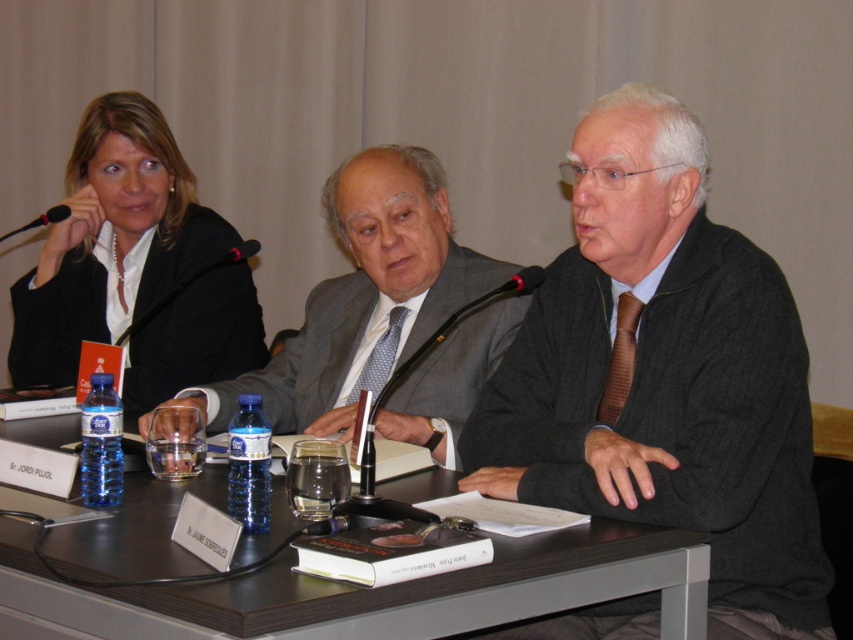
You are standing 1.5 meters away from the table where the three individuals are seated. There is a point marked at coordinates point [653,509]. Can you reach that point without moving closer than your current position?

The point [653,509] is 1.43 meters away from the viewer. Since you are currently 1.5 meters away, you cannot reach it without moving closer.

You are organizing a panel discussion and need to place a new speaker between the gray wool suit at center and the black plastic microphone at upper left. Based on their current positions, where should the new speaker be seated to maintain the existing spatial arrangement?

The new speaker should be seated between the gray wool suit at center and the black plastic microphone at upper left, aligning with the existing spatial arrangement where the gray wool suit at center is positioned under the black plastic microphone at upper left.